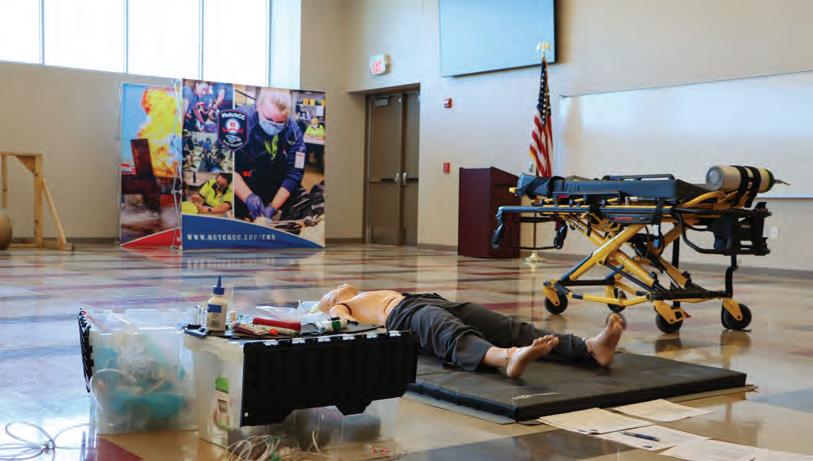
Where is `window`? window is located at coordinates (181, 45).